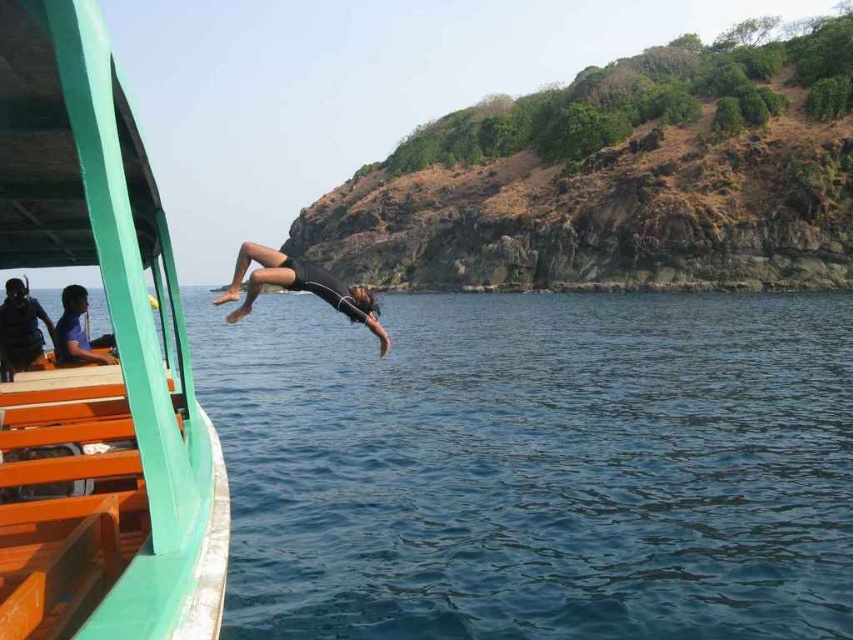
Question: Where is matte black wetsuit at left located in relation to matte black shorts at left in the image?

Choices:
 (A) right
 (B) left

Answer: (A)

Question: Is black matte diver at center wider than matte black shorts at left?

Choices:
 (A) no
 (B) yes

Answer: (A)

Question: Among these objects, which one is farthest from the camera?

Choices:
 (A) matte black wetsuit at left
 (B) deep blue water at center
 (C) black matte diver at center
 (D) green rocky cliff at upper right

Answer: (D)

Question: Among these points, which one is farthest from the camera?

Choices:
 (A) 329,218
 (B) 61,328

Answer: (A)

Question: Based on their relative distances, which object is farther from the green painted wood boat at left?

Choices:
 (A) matte black wetsuit at left
 (B) black matte diver at center
 (C) deep blue water at center
 (D) green rocky cliff at upper right

Answer: (D)

Question: Considering the relative positions of deep blue water at center and matte black wetsuit at left in the image provided, where is deep blue water at center located with respect to matte black wetsuit at left?

Choices:
 (A) below
 (B) above

Answer: (A)